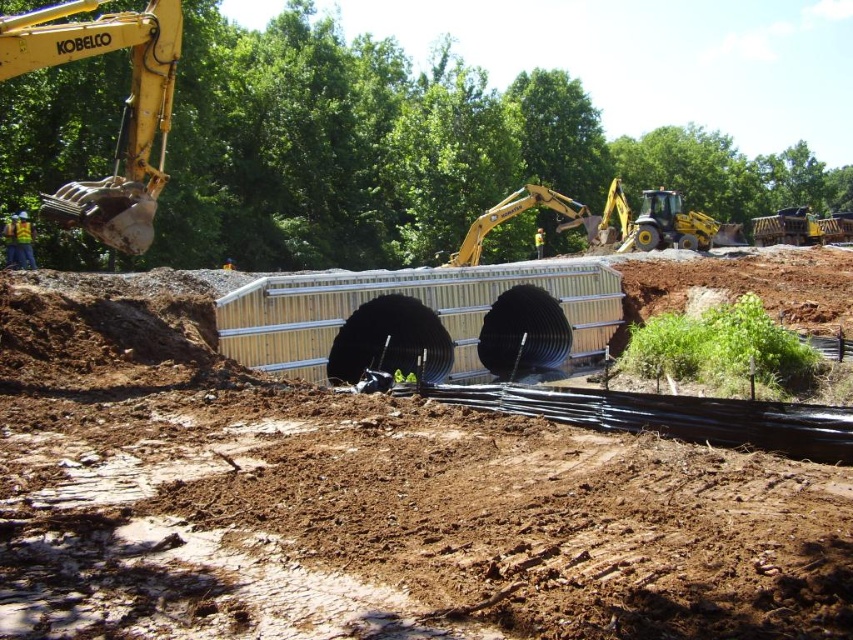
You are a construction worker tasked with placing a new sensor on the black corrugated pipe at center. The sensor must be placed at coordinates point A, which is at position point A at coordinates point A at coordinates point A at coordinates point A at coordinates point A at coordinates point A at coordinates point A at coordinates point A at coordinates point A at coordinates point A at coordinates point A at coordinates point A at coordinates point point A at coordinates point A at coordinates point A at

The black corrugated pipe at center is located at point A at coordinates point A at coordinates point A at coordinates point A at coordinates point A at coordinates point A at coordinates point A at coordinates point A at coordinates point A at coordinates point A at coordinates point A at coordinates point A at coordinates point A at coordinates point A at coordinates point A at coordinates point A at coordinates point A at coordinates point A at coordinates point A at coordinates point A at coordinates

You are a construction worker who needs to access the yellow metallic excavator at upper left. You are currently standing next to the black corrugated pipe at center. Which direction should you move to reach the excavator?

Since the black corrugated pipe at center is closer to the viewer than the yellow metallic excavator at upper left, you should move backward to reach the excavator.